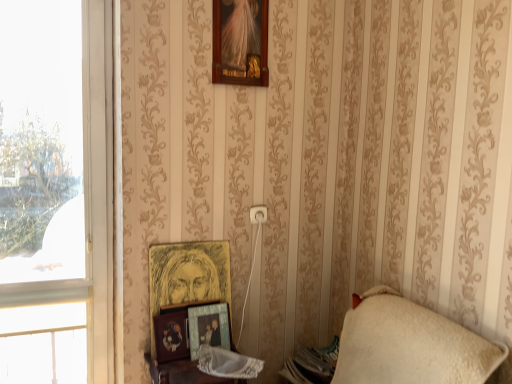
Where is `vacant area on top of wooden table at lower center (from a real-world perspective)`? This screenshot has height=384, width=512. vacant area on top of wooden table at lower center (from a real-world perspective) is located at coordinates (193, 365).